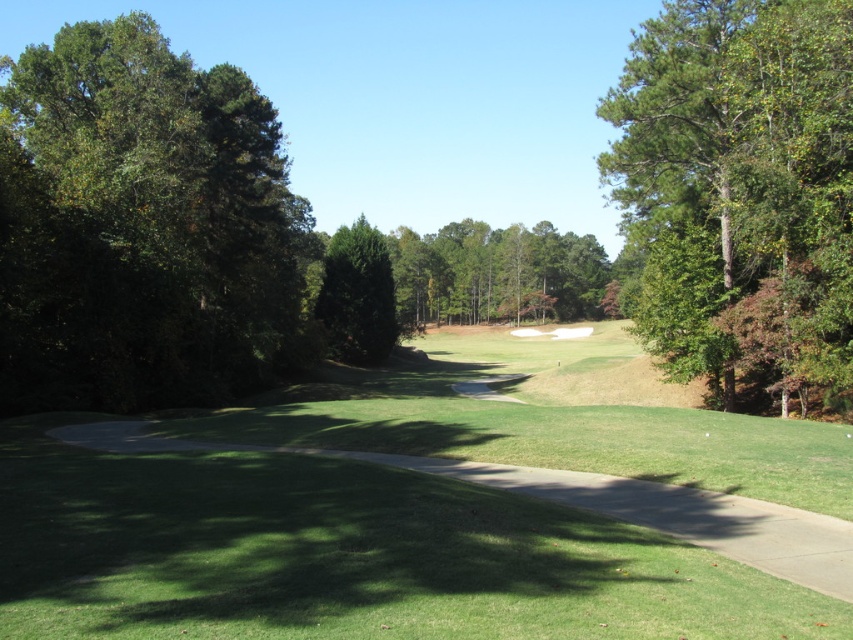
In the scene shown: You are standing on the green grassy golf course at center and want to walk towards the green leafy tree at center. Which direction should you head to reach it?

The green grassy golf course at center is below the green leafy tree at center, so you should head upwards to reach the tree.

You are standing on the golf course and see the green leafy tree at left and the green leafy tree at upper right. Which tree is positioned higher in the image?

The green leafy tree at left is positioned higher in the image than the green leafy tree at upper right.